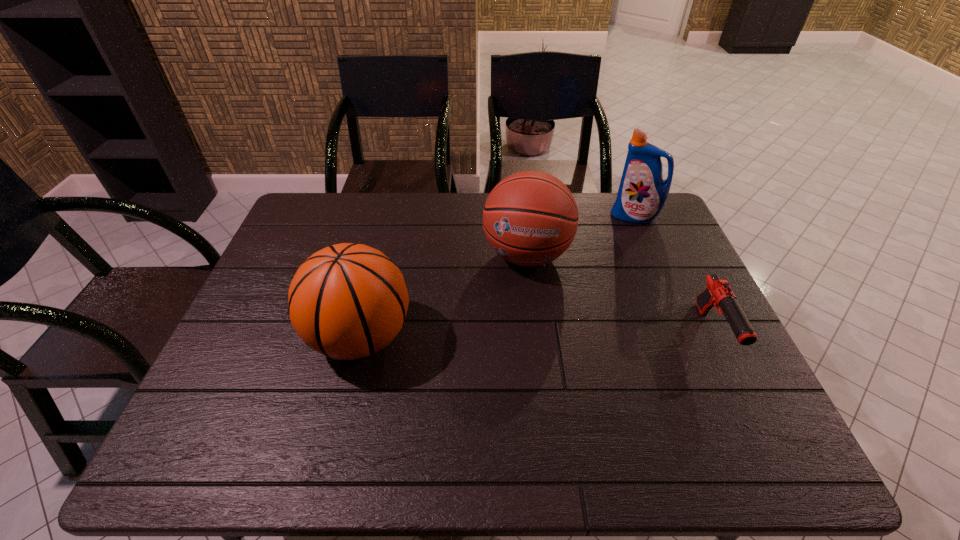
You are a GUI agent. You are given a task and a screenshot of the screen. Output one action in this format:
    pyautogui.click(x=<x>, y=<y>)
    Task: Click on the vacant space on the desktop that is between the left basketball and the gun and is positioned on the label of the farthest object
    
    Given the screenshot: What is the action you would take?
    pyautogui.click(x=562, y=335)

The image size is (960, 540). In order to click on vacant spot on the desktop that is between the leftmost object and the gun and is positioned on the logo side of the farther basketball in this screenshot , I will do `click(510, 335)`.